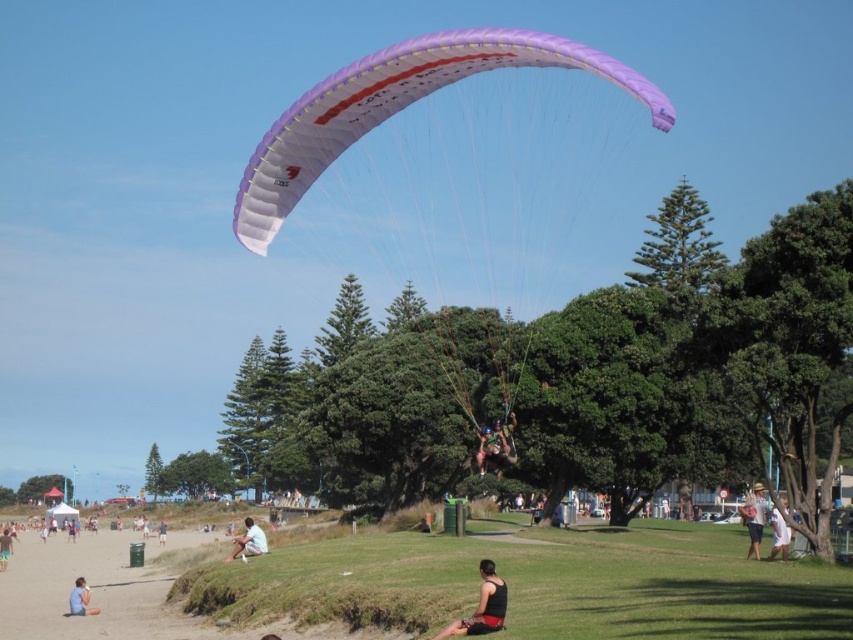
Between purple matte parachute at upper center and light brown fabric hat at lower right, which one is positioned higher?

purple matte parachute at upper center is above.

Can you confirm if purple matte parachute at upper center is positioned above light brown fabric hat at lower right?

Correct, purple matte parachute at upper center is located above light brown fabric hat at lower right.

Between point (306, 115) and point (752, 493), which one is positioned in front?

Point (306, 115) is in front.

Locate an element on the screen. The height and width of the screenshot is (640, 853). purple matte parachute at upper center is located at coordinates (396, 109).

Is light brown fabric hat at lower right above light blue shorts at lower left?

Yes.

Can you confirm if light brown fabric hat at lower right is positioned to the left of light blue shorts at lower left?

In fact, light brown fabric hat at lower right is to the right of light blue shorts at lower left.

Does point (762, 516) come in front of point (9, 540)?

Yes, it is.

The width and height of the screenshot is (853, 640). I want to click on light brown fabric hat at lower right, so click(x=753, y=516).

Does blue fabric shirt at lower left have a lesser width compared to light blue shorts at lower left?

Indeed, blue fabric shirt at lower left has a lesser width compared to light blue shorts at lower left.

Between point (74, 593) and point (4, 541), which one is positioned in front?

Point (74, 593) is more forward.

Is point (80, 579) positioned behind point (3, 570)?

No, it is in front of (3, 570).

Find the location of `blue fabric shirt at lower left`. blue fabric shirt at lower left is located at coordinates (80, 600).